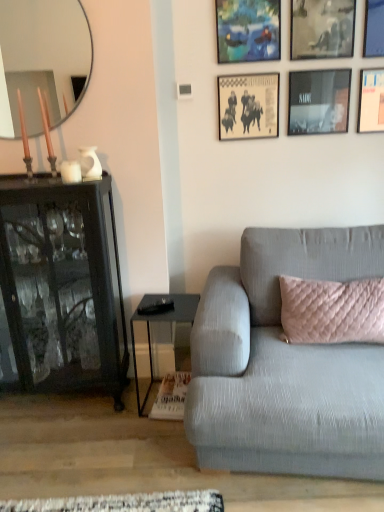
The height and width of the screenshot is (512, 384). I want to click on free space between metallic glass table at lower center and black glass cabinet at left, so click(127, 400).